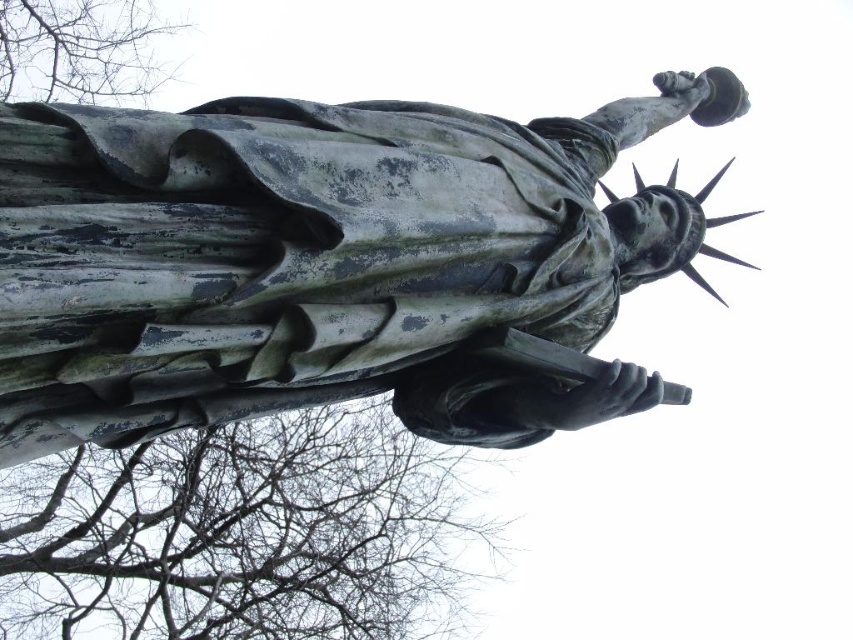
Question: Can you confirm if green patina statue at center is positioned to the right of bare branches at upper left?

Choices:
 (A) no
 (B) yes

Answer: (B)

Question: Which point is closer to the camera taking this photo?

Choices:
 (A) (9, 70)
 (B) (131, 506)
 (C) (366, 106)

Answer: (C)

Question: Which object is positioned farthest from the bare branches at upper left?

Choices:
 (A) green patina statue at center
 (B) bare branches at upper center

Answer: (A)

Question: Where is green patina statue at center located in relation to bare branches at upper center in the image?

Choices:
 (A) below
 (B) above

Answer: (B)

Question: Is green patina statue at center closer to camera compared to bare branches at upper left?

Choices:
 (A) yes
 (B) no

Answer: (A)

Question: Among these objects, which one is farthest from the camera?

Choices:
 (A) bare branches at upper left
 (B) bare branches at upper center

Answer: (A)